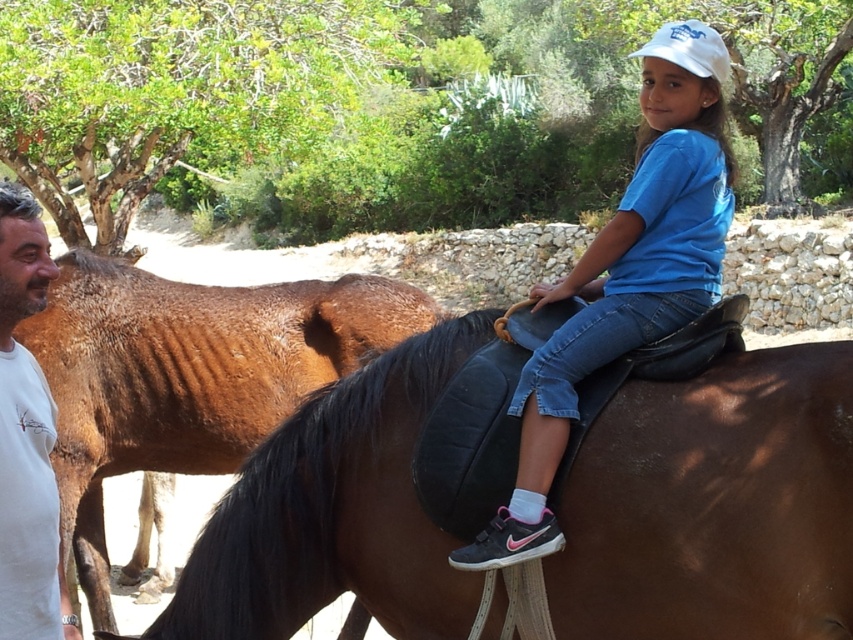
Question: Estimate the real-world distances between objects in this image. Which object is closer to the blue cotton shirt at center?

Choices:
 (A) white cotton shirt at left
 (B) brown shiny horse at left

Answer: (A)

Question: Can you confirm if brown shiny horse at left is bigger than white cotton shirt at left?

Choices:
 (A) yes
 (B) no

Answer: (A)

Question: Is brown leather saddle at upper center below blue cotton shirt at center?

Choices:
 (A) yes
 (B) no

Answer: (A)

Question: Which object is the farthest from the blue cotton shirt at center?

Choices:
 (A) white cotton shirt at left
 (B) brown shiny horse at left
 (C) brown leather saddle at upper center

Answer: (B)

Question: Is brown leather saddle at upper center in front of brown shiny horse at left?

Choices:
 (A) yes
 (B) no

Answer: (A)

Question: Which of the following is the closest to the observer?

Choices:
 (A) (648, 237)
 (B) (152, 413)
 (C) (195, 588)

Answer: (A)